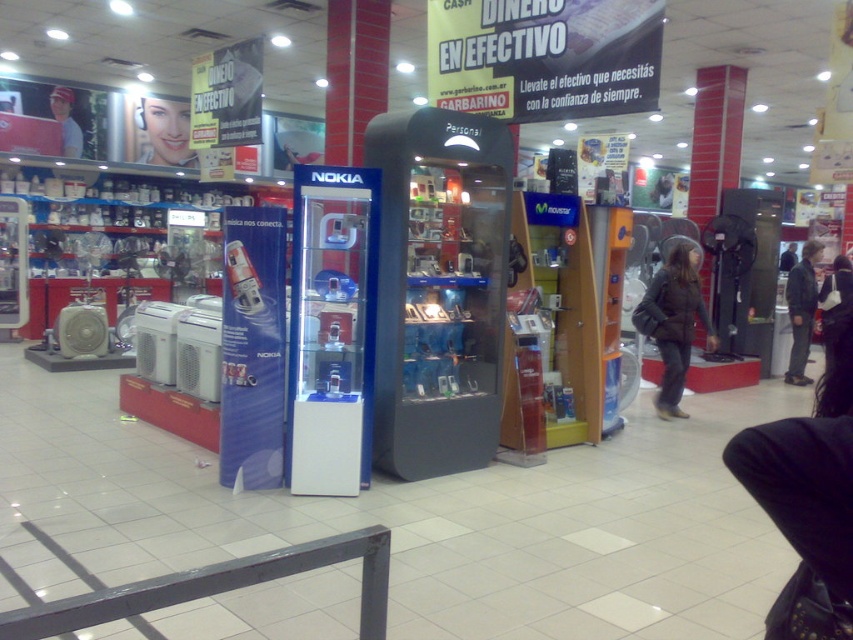
Question: Is dark gray jacket at center to the right of matte black phone at upper left from the viewer's perspective?

Choices:
 (A) no
 (B) yes

Answer: (B)

Question: Estimate the real-world distances between objects in this image. Which object is closer to the black leather jacket at center?

Choices:
 (A) dark gray jacket at center
 (B) matte black face at upper left
 (C) matte black phone at upper left

Answer: (A)

Question: Does matte black face at upper left have a greater width compared to dark gray jacket at center?

Choices:
 (A) no
 (B) yes

Answer: (B)

Question: Does black leather jacket at center appear on the left side of matte black phone at upper left?

Choices:
 (A) yes
 (B) no

Answer: (B)

Question: Considering the real-world distances, which object is farthest from the matte black phone at upper left?

Choices:
 (A) matte black face at upper left
 (B) dark gray jacket at center

Answer: (B)

Question: Estimate the real-world distances between objects in this image. Which object is closer to the matte black face at upper left?

Choices:
 (A) black leather jacket at center
 (B) dark gray jacket at center

Answer: (A)